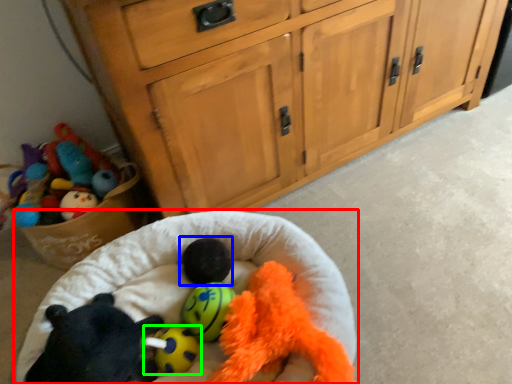
Question: Which object is positioned farthest from infant bed (highlighted by a red box)? Select from animal (highlighted by a blue box) and toy (highlighted by a green box).

Choices:
 (A) animal
 (B) toy

Answer: (B)